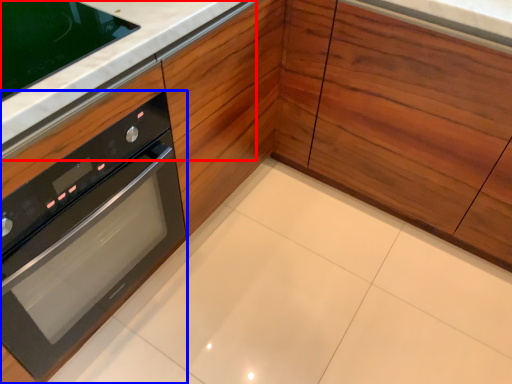
Question: Among these objects, which one is farthest to the camera, counter top (highlighted by a red box) or oven (highlighted by a blue box)?

Choices:
 (A) counter top
 (B) oven

Answer: (A)